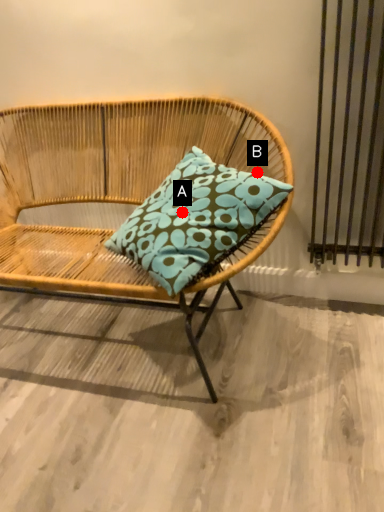
Question: Two points are circled on the image, labeled by A and B beside each circle. Which point is farther from the camera taking this photo?

Choices:
 (A) A is further
 (B) B is further

Answer: (B)